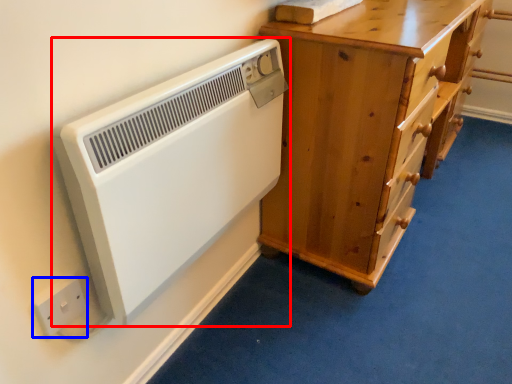
Question: Which point is further to the camera, home appliance (highlighted by a red box) or electric outlet (highlighted by a blue box)?

Choices:
 (A) home appliance
 (B) electric outlet

Answer: (B)